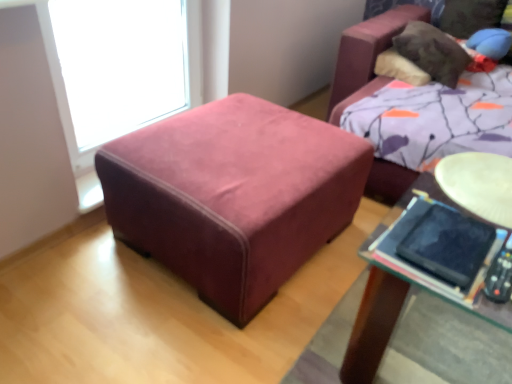
Question: Are transparent glass window at upper left and black matte tablet at lower right making contact?

Choices:
 (A) yes
 (B) no

Answer: (B)

Question: Considering the relative sizes of transparent glass window at upper left and black matte tablet at lower right in the image provided, is transparent glass window at upper left thinner than black matte tablet at lower right?

Choices:
 (A) yes
 (B) no

Answer: (A)

Question: Would you say transparent glass window at upper left is outside black matte tablet at lower right?

Choices:
 (A) yes
 (B) no

Answer: (A)

Question: Considering the relative sizes of transparent glass window at upper left and black matte tablet at lower right in the image provided, is transparent glass window at upper left shorter than black matte tablet at lower right?

Choices:
 (A) yes
 (B) no

Answer: (B)

Question: Considering the relative sizes of transparent glass window at upper left and black matte tablet at lower right in the image provided, is transparent glass window at upper left taller than black matte tablet at lower right?

Choices:
 (A) no
 (B) yes

Answer: (B)

Question: From the image's perspective, is transparent glass window at upper left above or below black matte tablet at lower right?

Choices:
 (A) above
 (B) below

Answer: (A)

Question: In the image, is transparent glass window at upper left positioned in front of or behind black matte tablet at lower right?

Choices:
 (A) behind
 (B) front

Answer: (A)

Question: From a real-world perspective, relative to black matte tablet at lower right, is transparent glass window at upper left vertically above or below?

Choices:
 (A) below
 (B) above

Answer: (A)

Question: Considering the relative positions of transparent glass window at upper left and black matte tablet at lower right in the image provided, is transparent glass window at upper left to the left or to the right of black matte tablet at lower right?

Choices:
 (A) left
 (B) right

Answer: (A)

Question: In terms of height, does black matte tablet at lower right look taller or shorter compared to velvet ottoman at center?

Choices:
 (A) short
 (B) tall

Answer: (A)

Question: Considering the relative positions of black matte tablet at lower right and velvet ottoman at center in the image provided, is black matte tablet at lower right to the left or to the right of velvet ottoman at center?

Choices:
 (A) right
 (B) left

Answer: (A)

Question: Is black matte tablet at lower right in front of or behind velvet ottoman at center in the image?

Choices:
 (A) front
 (B) behind

Answer: (A)

Question: Does point (404, 241) appear closer or farther from the camera than point (179, 258)?

Choices:
 (A) closer
 (B) farther

Answer: (A)

Question: From their relative heights in the image, would you say transparent glass window at upper left is taller or shorter than velvet ottoman at center?

Choices:
 (A) short
 (B) tall

Answer: (B)

Question: Which is correct: transparent glass window at upper left is inside velvet ottoman at center, or outside of it?

Choices:
 (A) inside
 (B) outside

Answer: (B)